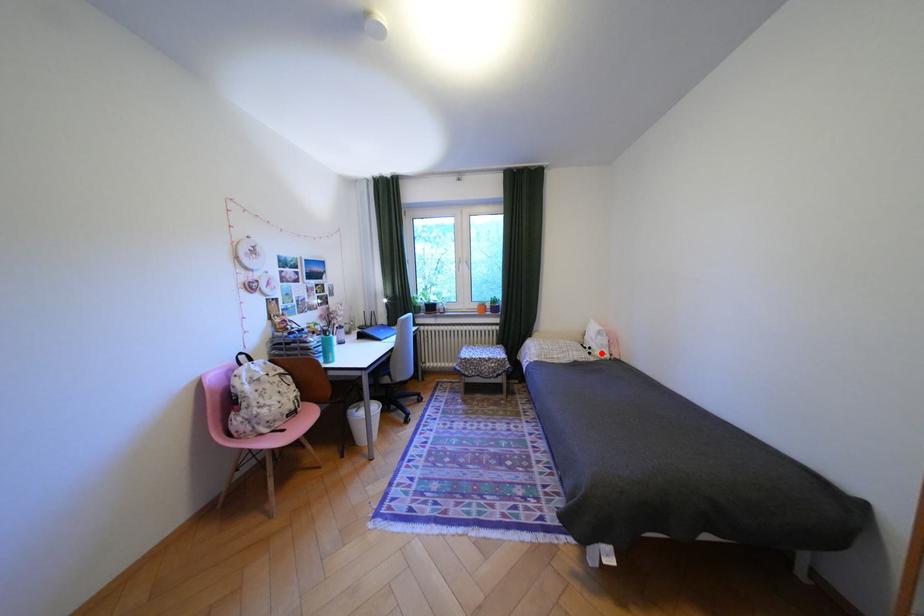
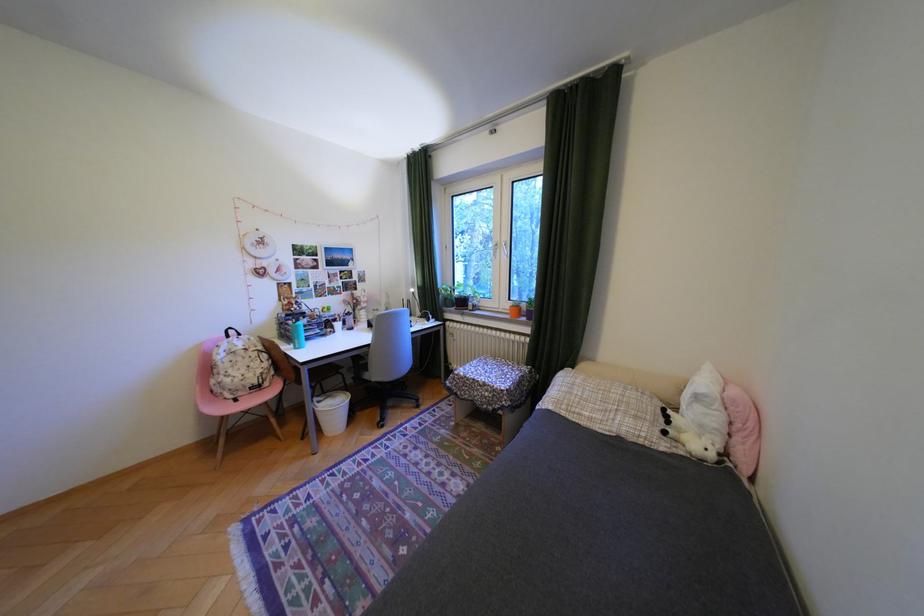
Question: I am providing you with two images of the same scene from different viewpoints. A red point is marked on the first image. At the location where the point appears in image 1, is it still visible in image 2?

Choices:
 (A) Yes
 (B) No

Answer: (A)